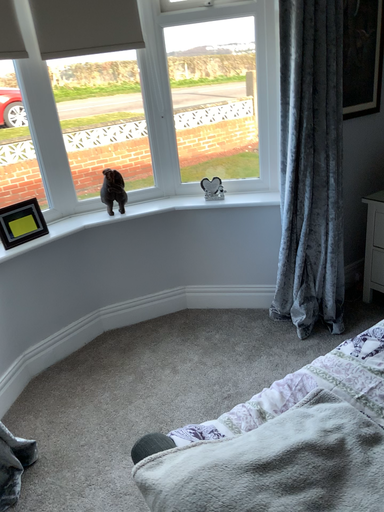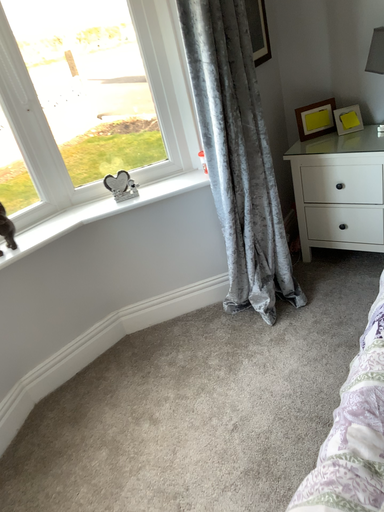
Question: Which way did the camera rotate in the video?

Choices:
 (A) rotated right
 (B) rotated left

Answer: (A)